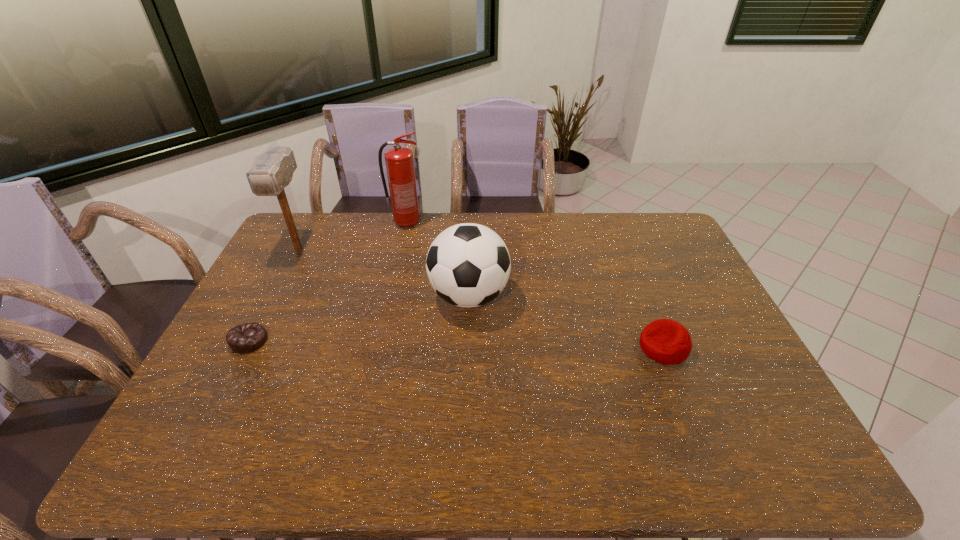
The image size is (960, 540). In order to click on object positioned at the right edge in this screenshot , I will do `click(665, 341)`.

You are a GUI agent. You are given a task and a screenshot of the screen. Output one action in this format:
    pyautogui.click(x=<x>, y=<y>)
    Task: Click on the object that is at the far left corner
    The image size is (960, 540).
    Given the screenshot: What is the action you would take?
    pyautogui.click(x=271, y=171)

Locate an element on the screen. vacant area at the far edge of the desktop is located at coordinates (582, 216).

Find the location of a particular element. Image resolution: width=960 pixels, height=540 pixels. vacant space at the near edge of the desktop is located at coordinates (578, 440).

Where is `vacant space at the left edge of the desktop`? The image size is (960, 540). vacant space at the left edge of the desktop is located at coordinates click(x=282, y=260).

What are the coordinates of `free location at the right edge` in the screenshot? It's located at (724, 336).

Identify the location of vacant space at the far right corner of the desktop. Image resolution: width=960 pixels, height=540 pixels. pos(650,232).

I want to click on free spot between the second farthest object and the shorter beanbag, so click(x=275, y=295).

The height and width of the screenshot is (540, 960). What are the coordinates of `free space between the shorter beanbag and the second object from right to left` in the screenshot? It's located at pyautogui.click(x=359, y=318).

Where is `free space between the left beanbag and the third object from right to left`? free space between the left beanbag and the third object from right to left is located at coordinates (328, 282).